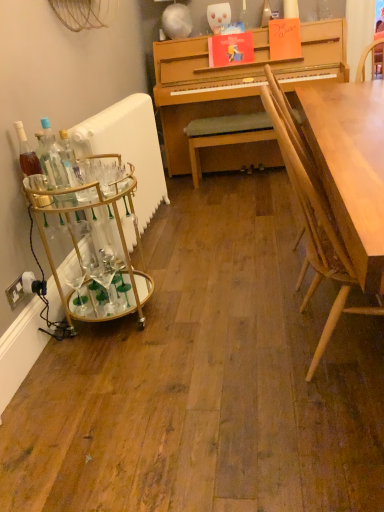
The width and height of the screenshot is (384, 512). What do you see at coordinates (313, 216) in the screenshot?
I see `light brown wood chair at right` at bounding box center [313, 216].

The image size is (384, 512). What are the coordinates of `translucent glass bottle at left, the 2th bottle when ordered from right to left` in the screenshot? It's located at (27, 153).

What do you see at coordinates (53, 158) in the screenshot? I see `clear glass bottle at left, the 1th bottle in the right-to-left sequence` at bounding box center [53, 158].

Find the location of a particular element. This screenshot has height=512, width=384. gold metallic bar cart at left is located at coordinates (94, 247).

Can you tell me how much white glossy radiator at left and light brown wood chair at right differ in facing direction?

2.35 degrees separate the facing orientations of white glossy radiator at left and light brown wood chair at right.

Is light brown wood chair at right at the back of white glossy radiator at left?

No.

Locate an element on the screen. chair in front of the white glossy radiator at left is located at coordinates (313, 216).

Is white glossy radiator at left taller or shorter than light brown wood chair at right?

Clearly, white glossy radiator at left is shorter compared to light brown wood chair at right.

Does white plastic power outlet at lower left have a larger size compared to clear glass bottle at left, placed as the 2th bottle when sorted from left to right?

Actually, white plastic power outlet at lower left might be smaller than clear glass bottle at left, placed as the 2th bottle when sorted from left to right.

Which is in front, point (23, 283) or point (67, 178)?

The point (67, 178) is in front.

The width and height of the screenshot is (384, 512). I want to click on power outlet lying below the clear glass bottle at left, placed as the 2th bottle when sorted from left to right (from the image's perspective), so click(28, 282).

Visually, is white plastic power outlet at lower left positioned to the left or to the right of clear glass bottle at left, the 1th bottle in the right-to-left sequence?

Based on their positions, white plastic power outlet at lower left is located to the left of clear glass bottle at left, the 1th bottle in the right-to-left sequence.

Does white plastic power outlet at lower left lie behind translucent glass bottle at left, the 2th bottle when ordered from right to left?

That is True.

From the image's perspective, is white plastic power outlet at lower left positioned above or below translucent glass bottle at left, the 2th bottle when ordered from right to left?

Based on their image positions, white plastic power outlet at lower left is located beneath translucent glass bottle at left, the 2th bottle when ordered from right to left.

Would you say white plastic power outlet at lower left is outside translucent glass bottle at left, the first bottle in the left-to-right sequence?

Indeed, white plastic power outlet at lower left is completely outside translucent glass bottle at left, the first bottle in the left-to-right sequence.

From a real-world perspective, is white plastic power outlet at lower left physically below translucent glass bottle at left, the 2th bottle when ordered from right to left?

Yes, from a real-world perspective, white plastic power outlet at lower left is beneath translucent glass bottle at left, the 2th bottle when ordered from right to left.

Between clear glass bottle at left, placed as the 2th bottle when sorted from left to right, and white plastic power outlet at lower left, which one has larger width?

With larger width is clear glass bottle at left, placed as the 2th bottle when sorted from left to right.

Is clear glass bottle at left, placed as the 2th bottle when sorted from left to right, to the left of white plastic power outlet at lower left from the viewer's perspective?

No.

Can you tell me how much clear glass bottle at left, placed as the 2th bottle when sorted from left to right, and white plastic power outlet at lower left differ in facing direction?

22.3 degrees separate the facing orientations of clear glass bottle at left, placed as the 2th bottle when sorted from left to right, and white plastic power outlet at lower left.

Does clear glass bottle at left, the 1th bottle in the right-to-left sequence, come behind white plastic power outlet at lower left?

No.

Which of these two, light brown wood chair at right or gold metallic bar cart at left, stands taller?

light brown wood chair at right.

From the image's perspective, is light brown wood chair at right above gold metallic bar cart at left?

Yes, from the image's perspective, light brown wood chair at right is above gold metallic bar cart at left.

Which is farther from the camera, (315, 220) or (127, 192)?

Positioned behind is point (127, 192).

Does light brown wood chair at right appear on the left side of gold metallic bar cart at left?

No, light brown wood chair at right is not to the left of gold metallic bar cart at left.

Is translucent glass bottle at left, the first bottle in the left-to-right sequence, at the left side of white glossy radiator at left?

Indeed, translucent glass bottle at left, the first bottle in the left-to-right sequence, is positioned on the left side of white glossy radiator at left.

Is white glossy radiator at left a part of translucent glass bottle at left, the first bottle in the left-to-right sequence?

No, white glossy radiator at left is located outside of translucent glass bottle at left, the first bottle in the left-to-right sequence.

Is translucent glass bottle at left, the 2th bottle when ordered from right to left, taller than white glossy radiator at left?

No, translucent glass bottle at left, the 2th bottle when ordered from right to left, is not taller than white glossy radiator at left.

Considering the relative positions of gold metallic bar cart at left and white plastic power outlet at lower left in the image provided, is gold metallic bar cart at left to the left or to the right of white plastic power outlet at lower left?

Clearly, gold metallic bar cart at left is on the right of white plastic power outlet at lower left in the image.

Is gold metallic bar cart at left completely or partially outside of white plastic power outlet at lower left?

Yes, gold metallic bar cart at left is outside of white plastic power outlet at lower left.

From the image's perspective, which object appears higher, gold metallic bar cart at left or white plastic power outlet at lower left?

gold metallic bar cart at left.

How different are the orientations of gold metallic bar cart at left and white plastic power outlet at lower left in degrees?

There is a 0.494-degree angle between the facing directions of gold metallic bar cart at left and white plastic power outlet at lower left.

This screenshot has height=512, width=384. I want to click on chair on the right of white glossy radiator at left, so click(313, 216).

Find the location of a particular element. power outlet behind the clear glass bottle at left, the 1th bottle in the right-to-left sequence is located at coordinates (28, 282).

Based on their spatial positions, is gold metallic bar cart at left or white plastic power outlet at lower left further from light brown wood chair at right?

white plastic power outlet at lower left is further to light brown wood chair at right.

When comparing their distances from light brown wood chair at right, does gold metallic bar cart at left or white glossy radiator at left seem closer?

gold metallic bar cart at left is closer to light brown wood chair at right.

Which object lies further to the anchor point light brown wood chair at right, gold metallic bar cart at left or clear glass bottle at left, the 1th bottle in the right-to-left sequence?

The object further to light brown wood chair at right is clear glass bottle at left, the 1th bottle in the right-to-left sequence.

Considering their positions, is clear glass bottle at left, placed as the 2th bottle when sorted from left to right, positioned closer to gold metallic bar cart at left than white plastic power outlet at lower left?

Among the two, clear glass bottle at left, placed as the 2th bottle when sorted from left to right, is located nearer to gold metallic bar cart at left.

Considering their positions, is clear glass bottle at left, the 1th bottle in the right-to-left sequence, positioned further to white glossy radiator at left than gold metallic bar cart at left?

Among the two, clear glass bottle at left, the 1th bottle in the right-to-left sequence, is located further to white glossy radiator at left.

Which object lies further to the anchor point gold metallic bar cart at left, white plastic power outlet at lower left or light brown wood chair at right?

The object further to gold metallic bar cart at left is light brown wood chair at right.

Considering their positions, is white plastic power outlet at lower left positioned closer to white glossy radiator at left than translucent glass bottle at left, the first bottle in the left-to-right sequence?

translucent glass bottle at left, the first bottle in the left-to-right sequence, lies closer to white glossy radiator at left than the other object.

Looking at this image, based on their spatial positions, is white glossy radiator at left or light brown wood chair at right further from translucent glass bottle at left, the first bottle in the left-to-right sequence?

light brown wood chair at right.

Identify the location of radiator between translucent glass bottle at left, the 2th bottle when ordered from right to left, and light brown wood chair at right from left to right. The width and height of the screenshot is (384, 512). (128, 148).

You are a GUI agent. You are given a task and a screenshot of the screen. Output one action in this format:
    pyautogui.click(x=<x>, y=<y>)
    Task: Click on the desk located between white plastic power outlet at lower left and light brown wood chair at right in the left-right direction
    This screenshot has width=384, height=512.
    Given the screenshot: What is the action you would take?
    pyautogui.click(x=94, y=247)

Where is `desk that lies between clear glass bottle at left, placed as the 2th bottle when sorted from left to right, and white plastic power outlet at lower left from top to bottom`? Image resolution: width=384 pixels, height=512 pixels. desk that lies between clear glass bottle at left, placed as the 2th bottle when sorted from left to right, and white plastic power outlet at lower left from top to bottom is located at coordinates (94, 247).

Locate an element on the screen. The image size is (384, 512). desk between clear glass bottle at left, placed as the 2th bottle when sorted from left to right, and light brown wood chair at right is located at coordinates (94, 247).